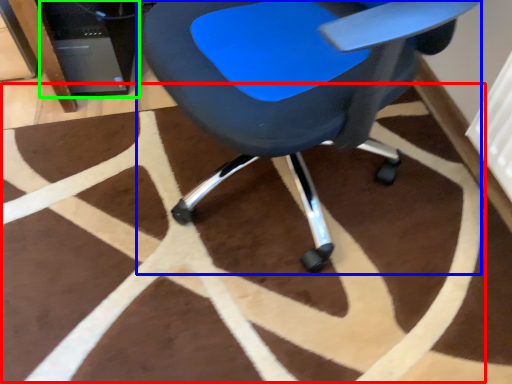
Question: Estimate the real-world distances between objects in this image. Which object is farther from mat (highlighted by a red box), chair (highlighted by a blue box) or computer tower (highlighted by a green box)?

Choices:
 (A) chair
 (B) computer tower

Answer: (B)